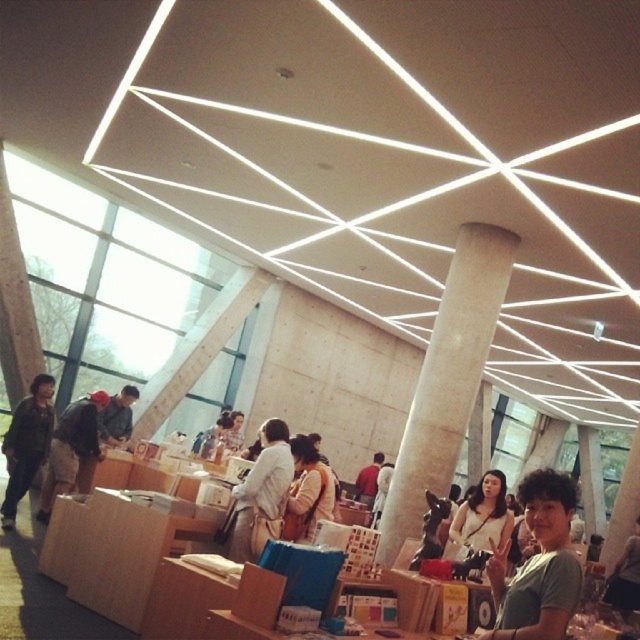
Is point (467, 428) positioned in front of point (128, 394)?

Yes, it is in front of point (128, 394).

Is white concrete pillar at center to the right of matte gray shirt at center from the viewer's perspective?

Correct, you'll find white concrete pillar at center to the right of matte gray shirt at center.

Is point (433, 472) in front of point (125, 416)?

Yes, point (433, 472) is in front of point (125, 416).

Image resolution: width=640 pixels, height=640 pixels. I want to click on white concrete pillar at center, so click(x=448, y=378).

Does point (285, 444) lie behind point (115, 420)?

No, (285, 444) is in front of (115, 420).

Does white cotton shirt at center appear on the left side of matte gray shirt at center?

Incorrect, white cotton shirt at center is not on the left side of matte gray shirt at center.

Where is `white cotton shirt at center`? white cotton shirt at center is located at coordinates (260, 488).

Find the location of a particular element. white cotton shirt at center is located at coordinates (260, 488).

Is white cotton shirt at center closer to the viewer compared to brown fuzzy jacket at left?

Yes, it is.

Who is positioned more to the right, white cotton shirt at center or brown fuzzy jacket at left?

white cotton shirt at center is more to the right.

The width and height of the screenshot is (640, 640). Identify the location of white cotton shirt at center. (260, 488).

I want to click on white cotton shirt at center, so 260,488.